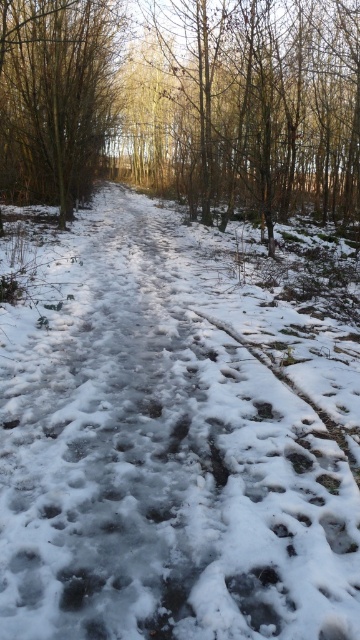
You are a hiker navigating a winter forest and notice a point marked at coordinates (x=266, y=102). Based on the scene description, what object or feature is located at this point?

The point at coordinates (x=266, y=102) corresponds to brown dry wood at upper center.

You are standing at the edge of the forest and see the white frosty path at center. If you take a step forward, will you be closer to the path than 1.20 meters?

The white frosty path at center is 1.20 meters away from viewer. If you take a step forward, you will be closer than 1.20 meters to the path.